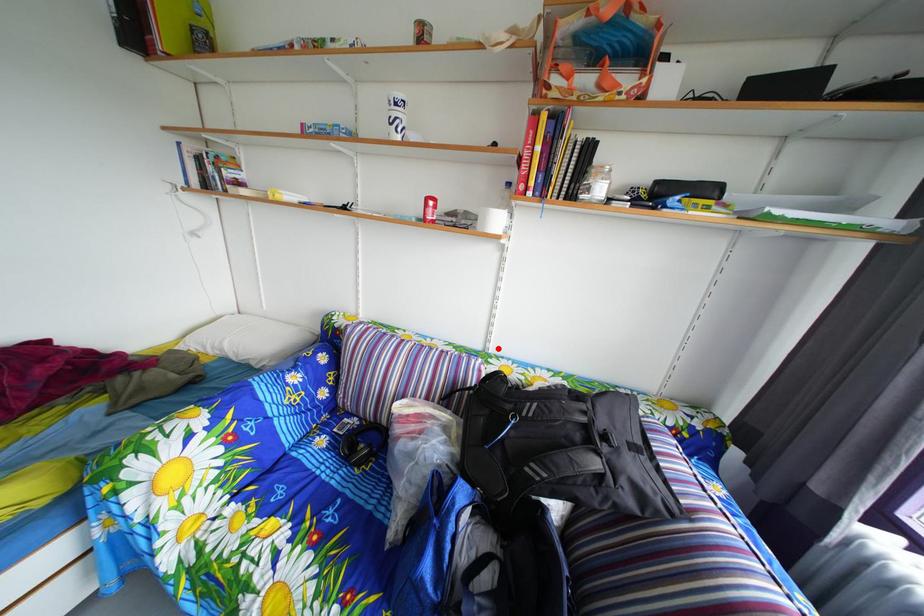
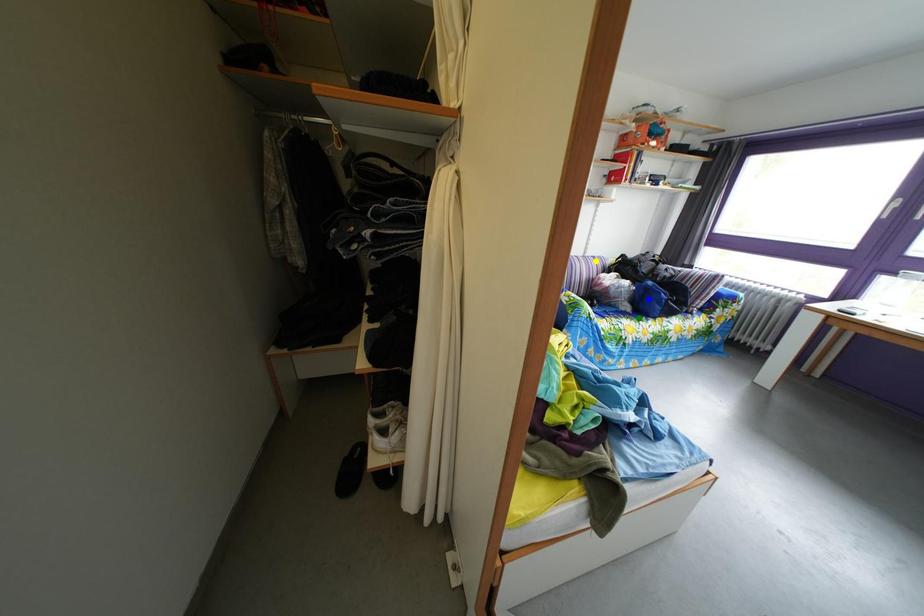
Question: I am providing you with two images of the same scene from different viewpoints. A red point is marked on the first image. You are given multiple points on the second image. Which point in image 2 is actually the same real-world point as the red point in image 1?

Choices:
 (A) blue point
 (B) yellow point
 (C) green point

Answer: (B)